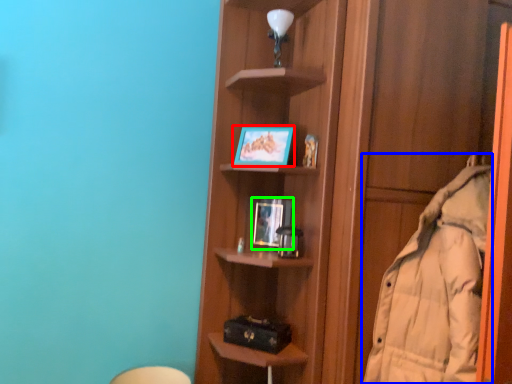
Question: Which is nearer to the picture frame (highlighted by a red box)? coat (highlighted by a blue box) or picture frame (highlighted by a green box).

Choices:
 (A) coat
 (B) picture frame

Answer: (B)